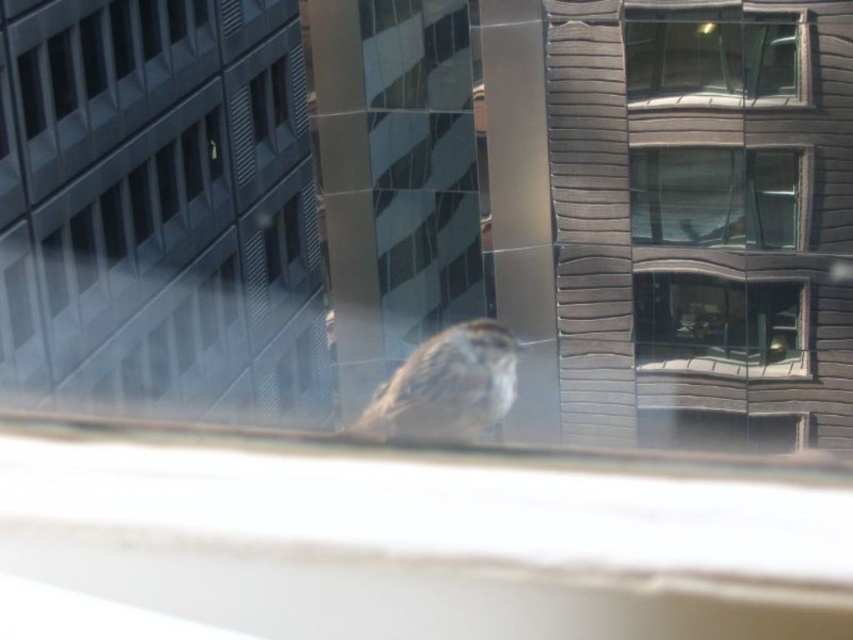
You are an architect analyzing the building reflections in the image. You notice the clear glass window at upper center and the transparent glass window at center. Which of these two windows has a smaller height?

The clear glass window at upper center has a lesser height compared to the transparent glass window at center, so it is the smaller one.

From the picture: You are looking through the window and see two points marked on the glass. The first point is at coordinate point(769, 214) and the second is at point(451, 429). Which point is closer to you?

Point(451, 429) is closer to you because it is in front of point(769, 214).

You are an architect analyzing the image. You need to determine the position of the clear glass window at upper center in the scene. What are its coordinates?

The clear glass window at upper center is located at coordinates point (712, 56).